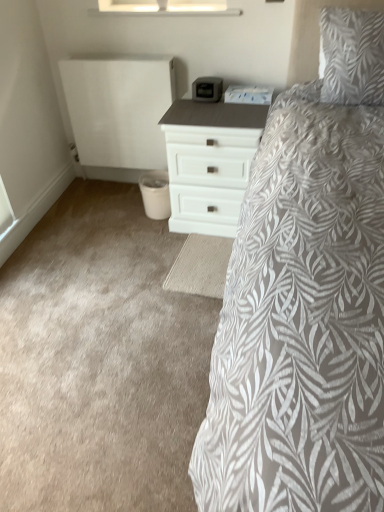
Question: Can you confirm if white leaf-patterned pillow at upper right is bigger than white matte chest of drawers at center?

Choices:
 (A) yes
 (B) no

Answer: (B)

Question: Is white leaf-patterned pillow at upper right at the left side of white matte chest of drawers at center?

Choices:
 (A) yes
 (B) no

Answer: (B)

Question: Is white leaf-patterned pillow at upper right closer to camera compared to white matte chest of drawers at center?

Choices:
 (A) no
 (B) yes

Answer: (B)

Question: Does white leaf-patterned pillow at upper right have a lesser width compared to white matte chest of drawers at center?

Choices:
 (A) yes
 (B) no

Answer: (A)

Question: Does white leaf-patterned pillow at upper right have a lesser height compared to white matte chest of drawers at center?

Choices:
 (A) yes
 (B) no

Answer: (A)

Question: From the image's perspective, does white leaf-patterned pillow at upper right appear higher than white matte chest of drawers at center?

Choices:
 (A) no
 (B) yes

Answer: (B)

Question: Is transparent glass window at upper center bigger than white leaf-patterned pillow at upper right?

Choices:
 (A) no
 (B) yes

Answer: (A)

Question: From a real-world perspective, is transparent glass window at upper center over white leaf-patterned pillow at upper right?

Choices:
 (A) yes
 (B) no

Answer: (A)

Question: Is transparent glass window at upper center positioned behind white leaf-patterned pillow at upper right?

Choices:
 (A) yes
 (B) no

Answer: (A)

Question: Is transparent glass window at upper center far from white leaf-patterned pillow at upper right?

Choices:
 (A) yes
 (B) no

Answer: (B)

Question: Does transparent glass window at upper center have a greater height compared to white leaf-patterned pillow at upper right?

Choices:
 (A) no
 (B) yes

Answer: (A)

Question: Is transparent glass window at upper center at the right side of white leaf-patterned pillow at upper right?

Choices:
 (A) no
 (B) yes

Answer: (A)

Question: Is white matte chest of drawers at center positioned behind white leaf-patterned pillow at upper right?

Choices:
 (A) yes
 (B) no

Answer: (A)